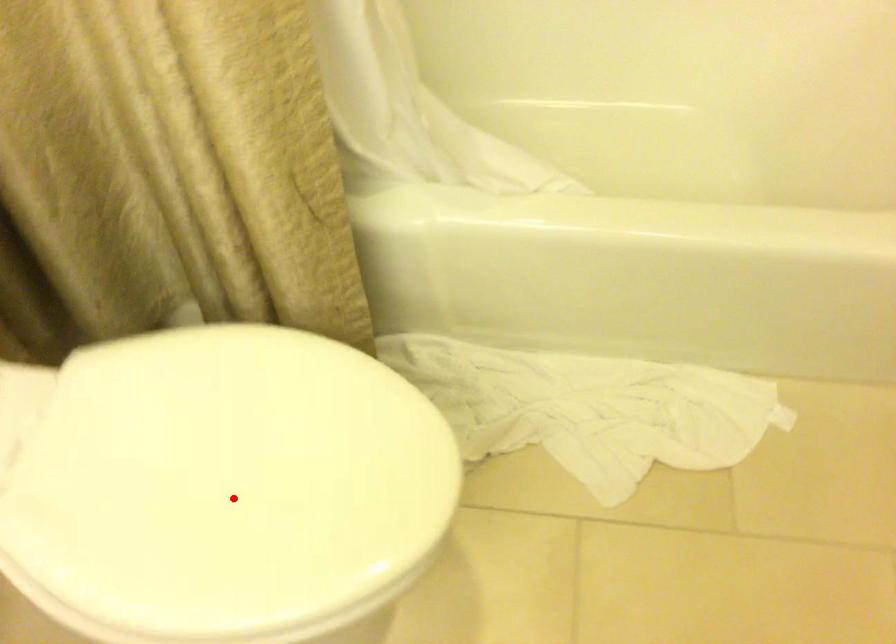
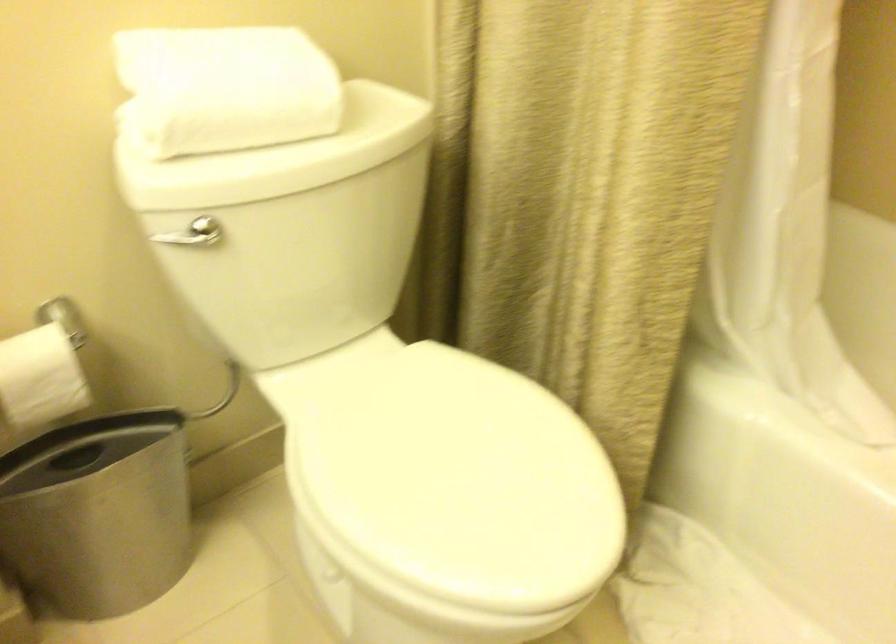
Question: I am providing you with two images of the same scene from different viewpoints. Given a red point in image1, look at the same physical point in image2. Is it:

Choices:
 (A) Closer to the viewpoint
 (B) Farther from the viewpoint

Answer: (B)